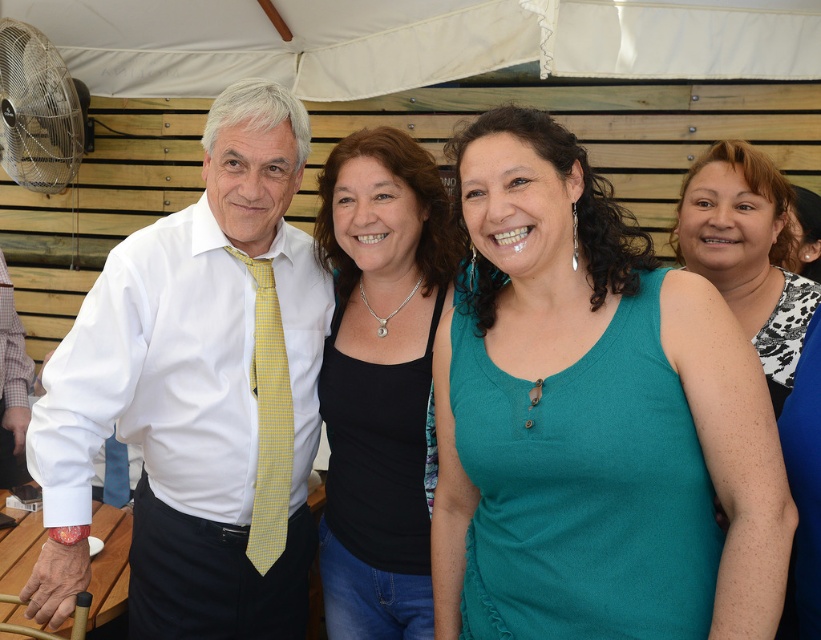
Question: Is white shirt at left behind yellowtexturetie at left?

Choices:
 (A) yes
 (B) no

Answer: (B)

Question: Among these objects, which one is farthest from the camera?

Choices:
 (A) teal fabric tank top at center
 (B) yellowtexturetie at left
 (C) white fabric canopy at upper center
 (D) teal fabric tank top at right

Answer: (C)

Question: Is the position of teal fabric tank top at center more distant than that of teal fabric tank top at right?

Choices:
 (A) no
 (B) yes

Answer: (A)

Question: Estimate the real-world distances between objects in this image. Which object is farther from the teal fabric tank top at center?

Choices:
 (A) teal fabric tank top at right
 (B) black matte tank top at center

Answer: (A)

Question: Is teal fabric tank top at center positioned behind white fabric canopy at upper center?

Choices:
 (A) no
 (B) yes

Answer: (A)

Question: Among these objects, which one is farthest from the camera?

Choices:
 (A) white shirt at left
 (B) teal fabric tank top at center

Answer: (A)